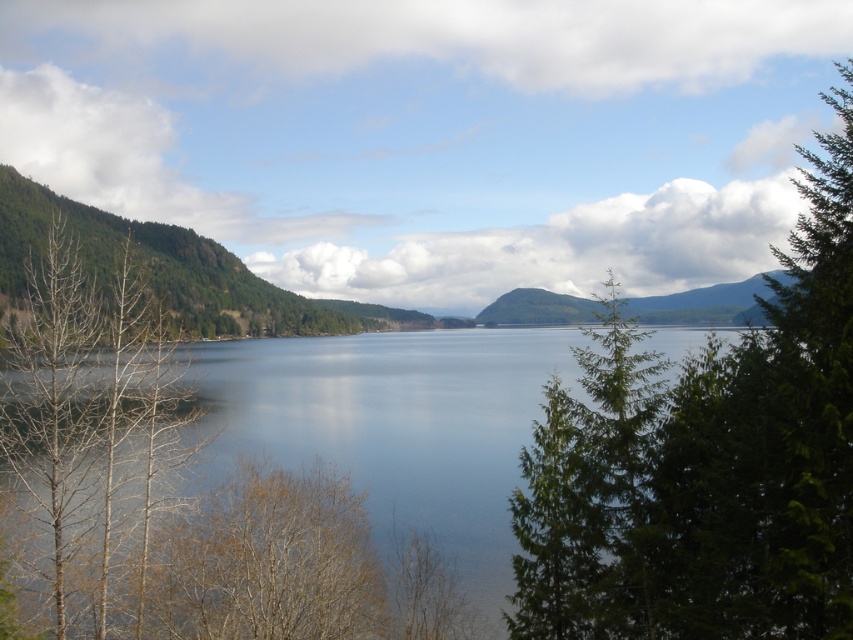
Can you confirm if brown leafless tree at left is smaller than green forested mountain at center?

Indeed, brown leafless tree at left has a smaller size compared to green forested mountain at center.

Can you confirm if brown leafless tree at left is bigger than green forested mountain at center?

No, brown leafless tree at left is not bigger than green forested mountain at center.

Between point (38, 392) and point (735, 305), which one is positioned behind?

Positioned behind is point (735, 305).

The image size is (853, 640). I want to click on brown leafless tree at left, so click(88, 420).

Does green textured tree at right have a greater width compared to brown leafless tree at left?

No, green textured tree at right is not wider than brown leafless tree at left.

Is point (561, 602) closer to camera compared to point (132, 449)?

Yes, point (561, 602) is in front of point (132, 449).

The height and width of the screenshot is (640, 853). In order to click on green textured tree at right in this screenshot , I will do `click(706, 464)`.

You are a GUI agent. You are given a task and a screenshot of the screen. Output one action in this format:
    pyautogui.click(x=<x>, y=<y>)
    Task: Click on the green textured tree at right
    The width and height of the screenshot is (853, 640).
    Given the screenshot: What is the action you would take?
    pyautogui.click(x=706, y=464)

Can you confirm if green textured tree at right is positioned above green forested mountain at center?

Incorrect, green textured tree at right is not positioned above green forested mountain at center.

This screenshot has height=640, width=853. What do you see at coordinates (706, 464) in the screenshot?
I see `green textured tree at right` at bounding box center [706, 464].

Identify the location of green textured tree at right. (706, 464).

At what (x,y) coordinates should I click in order to perform the action: click on green textured tree at right. Please return your answer as a coordinate pair (x, y). The height and width of the screenshot is (640, 853). Looking at the image, I should click on (706, 464).